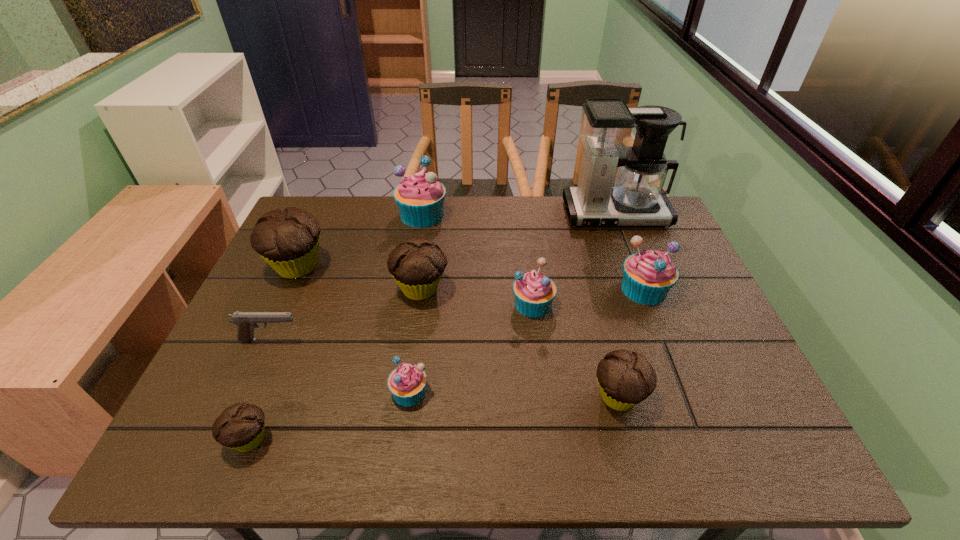
The height and width of the screenshot is (540, 960). I want to click on gray coffee maker, so click(607, 126).

The image size is (960, 540). Find the location of `coffee maker`. coffee maker is located at coordinates (607, 126).

Image resolution: width=960 pixels, height=540 pixels. Identify the location of the farthest muffin. (420, 197).

I want to click on the biggest blue muffin, so click(420, 197).

Identify the location of the biggest chocolate muffin. (288, 240).

You are a GUI agent. You are given a task and a screenshot of the screen. Output one action in this format:
    pyautogui.click(x=<x>, y=<y>)
    Task: Click on the rightmost blue muffin
    
    Given the screenshot: What is the action you would take?
    pyautogui.click(x=648, y=276)

Locate an element on the screen. The width and height of the screenshot is (960, 540). the rightmost muffin is located at coordinates (648, 276).

Identify the location of the second chocolate muffin from right to left. (416, 264).

Where is `the seventh object from left to right`? The width and height of the screenshot is (960, 540). the seventh object from left to right is located at coordinates (534, 292).

The height and width of the screenshot is (540, 960). Find the location of `the third blue muffin from left to right`. the third blue muffin from left to right is located at coordinates (534, 292).